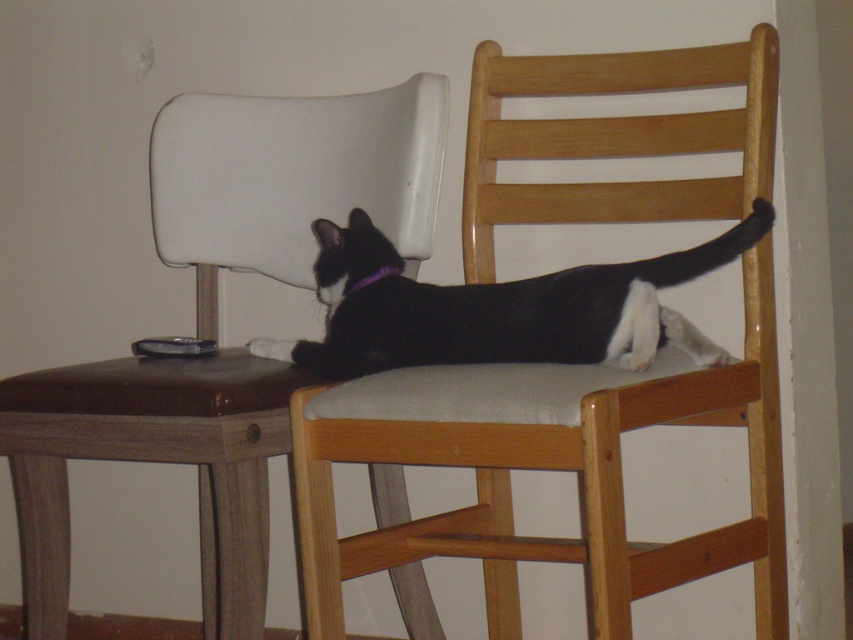
Based on the photo, you are a guest in this room and want to pick up the satin black remote at upper left and the purple fabric neckband at center. Which object should you reach for first to grab both without moving your position?

You should reach for the satin black remote at upper left first because it is closer to you than the purple fabric neckband at center. After picking it up, you can then reach for the purple fabric neckband at center.

You are a delivery robot with a 12 inch wide package. You need to place the package between the satin black remote at upper left and the purple fabric neckband at center. Can you fit the package in that space?

The satin black remote at upper left is 12.23 inches from purple fabric neckband at center. Since the package is 12 inches wide, it can fit in the space between them as the distance is slightly larger than the package width.